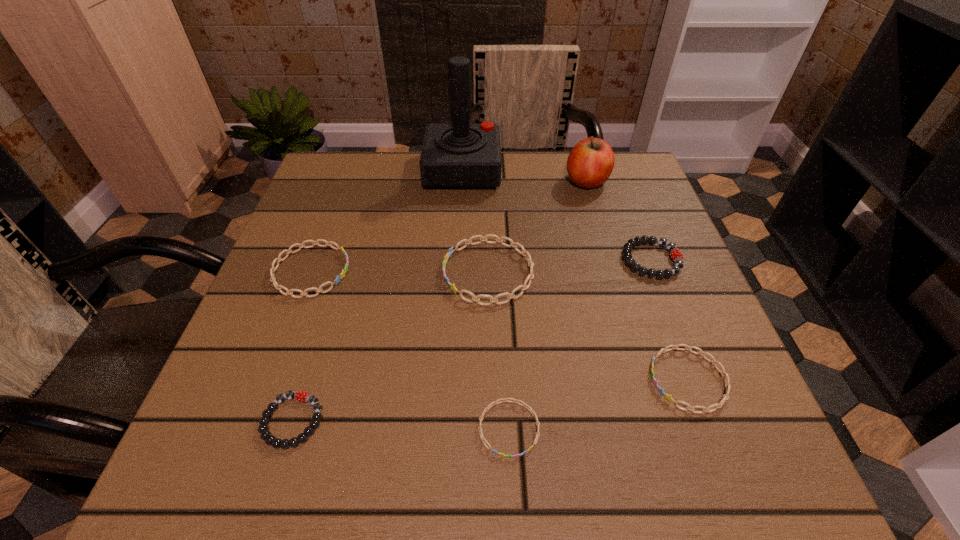
Select which blue bracelet is the closest to the tallest bracelet. Please provide its 2D coordinates. Your answer should be formatted as a tuple, i.e. [(x, y)], where the tuple contains the x and y coordinates of a point satisfying the conditions above.

[(278, 260)]

Locate an element on the screen. vacant region that satisfies the following two spatial constraints: 1. on the back side of the smaller black bracelet; 2. on the right side of the right black bracelet is located at coordinates (343, 260).

Where is `free point that satisfies the following two spatial constraints: 1. on the back side of the smaller black bracelet; 2. on the left side of the apple`? The image size is (960, 540). free point that satisfies the following two spatial constraints: 1. on the back side of the smaller black bracelet; 2. on the left side of the apple is located at coordinates (368, 181).

Where is `free location that satisfies the following two spatial constraints: 1. on the base of the red joystick; 2. on the left side of the apple`? The width and height of the screenshot is (960, 540). free location that satisfies the following two spatial constraints: 1. on the base of the red joystick; 2. on the left side of the apple is located at coordinates (462, 181).

Find the location of a particular element. free location that satisfies the following two spatial constraints: 1. on the front side of the bigger black bracelet; 2. on the left side of the apple is located at coordinates (610, 260).